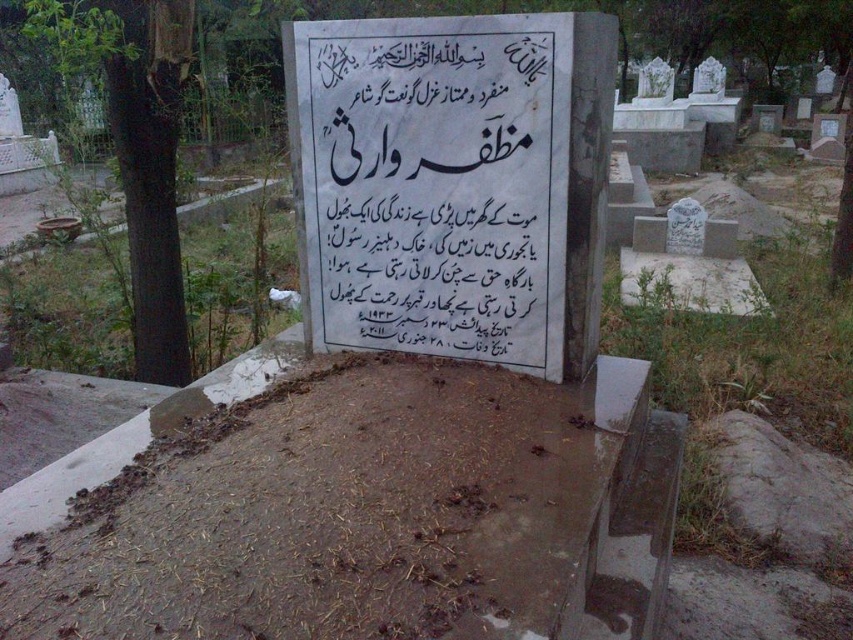
Question: Can you confirm if brown dirt at lower center is bigger than white marble sign at center?

Choices:
 (A) yes
 (B) no

Answer: (A)

Question: Is brown dirt at lower center bigger than white marble sign at center?

Choices:
 (A) yes
 (B) no

Answer: (A)

Question: Which point is farther to the camera?

Choices:
 (A) brown dirt at lower center
 (B) white marble sign at center

Answer: (B)

Question: Does brown dirt at lower center have a greater width compared to white marble sign at center?

Choices:
 (A) no
 (B) yes

Answer: (B)

Question: Which of the following is the closest to the observer?

Choices:
 (A) (515, 236)
 (B) (395, 625)

Answer: (B)